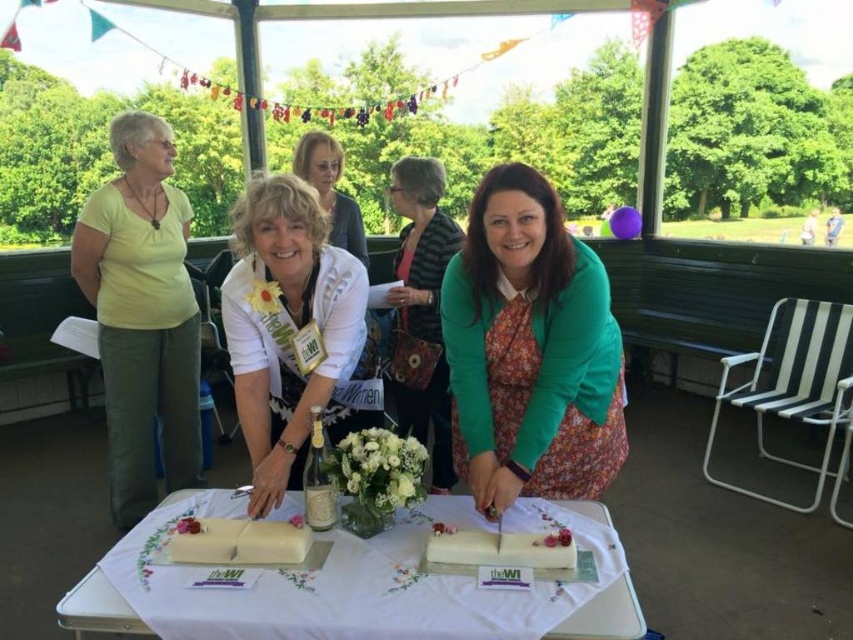
Is white fabric tablecloth at center behind white matte cake at lower center?

No.

Who is more distant from viewer, (630, 625) or (190, 557)?

The point (190, 557) is behind.

Image resolution: width=853 pixels, height=640 pixels. Find the location of `white fabric tablecloth at center`. white fabric tablecloth at center is located at coordinates (96, 609).

Does light green cotton shirt at left appear under matte black jacket at upper center?

Yes.

Does light green cotton shirt at left appear on the right side of matte black jacket at upper center?

In fact, light green cotton shirt at left is to the left of matte black jacket at upper center.

The height and width of the screenshot is (640, 853). I want to click on light green cotton shirt at left, so [142, 316].

Can you confirm if green fabric dress at center is taller than white fabric tablecloth at center?

Yes, green fabric dress at center is taller than white fabric tablecloth at center.

Does green fabric dress at center come behind white fabric tablecloth at center?

Yes, green fabric dress at center is behind white fabric tablecloth at center.

What do you see at coordinates (421, 310) in the screenshot?
I see `green fabric dress at center` at bounding box center [421, 310].

You are a GUI agent. You are given a task and a screenshot of the screen. Output one action in this format:
    pyautogui.click(x=<x>, y=<y>)
    Task: Click on the green fabric dress at center
    The width and height of the screenshot is (853, 640).
    Given the screenshot: What is the action you would take?
    pyautogui.click(x=421, y=310)